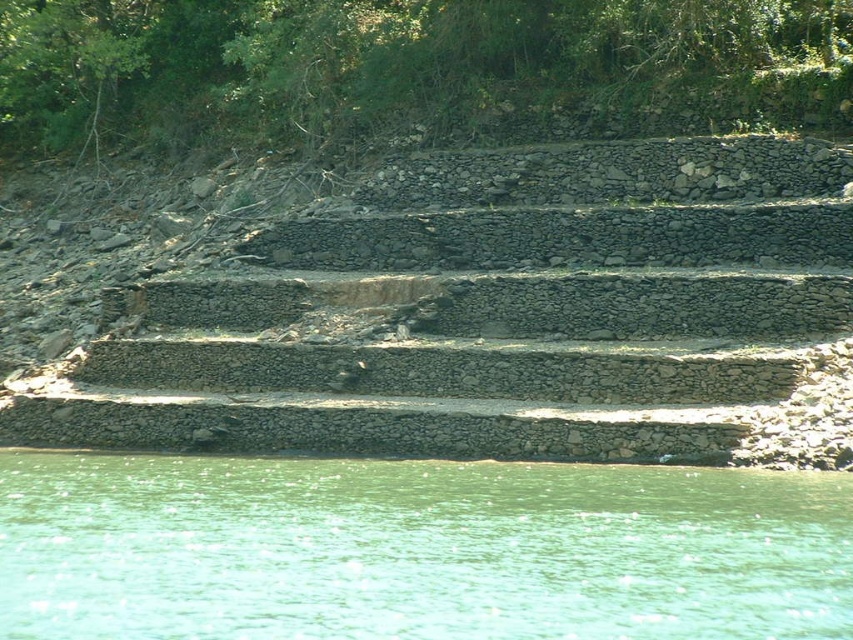
Question: Can you confirm if gray stone stairs at center is positioned to the left of green water at lower center?

Choices:
 (A) no
 (B) yes

Answer: (B)

Question: From the image, what is the correct spatial relationship of gray stone stairs at center in relation to green water at lower center?

Choices:
 (A) above
 (B) below

Answer: (A)

Question: Among these objects, which one is farthest from the camera?

Choices:
 (A) green water at lower center
 (B) gray stone stairs at center

Answer: (B)

Question: Is gray stone stairs at center positioned before green water at lower center?

Choices:
 (A) yes
 (B) no

Answer: (B)

Question: Which of the following is the closest to the observer?

Choices:
 (A) gray stone stairs at center
 (B) green water at lower center

Answer: (B)

Question: Among these points, which one is nearest to the camera?

Choices:
 (A) (100, 428)
 (B) (120, 531)

Answer: (B)